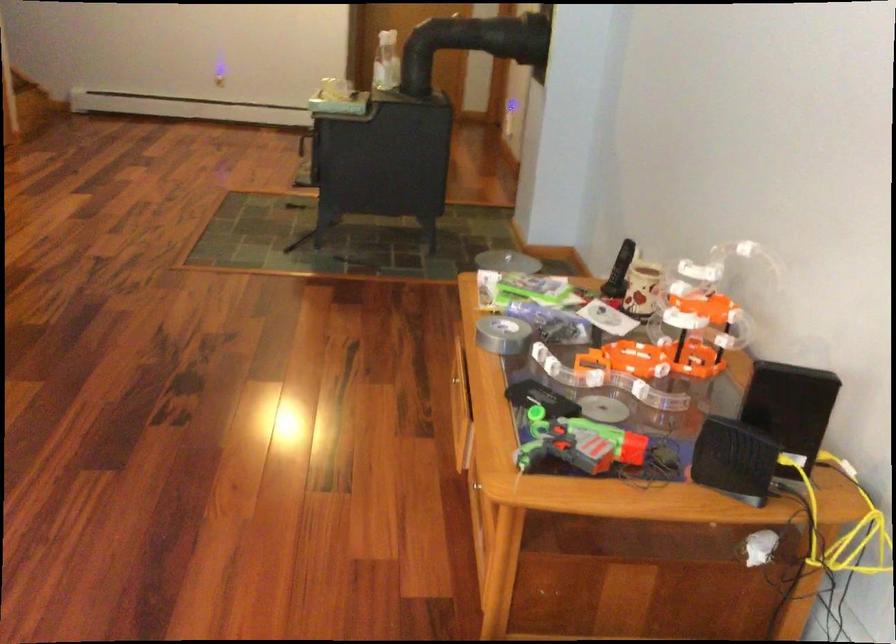
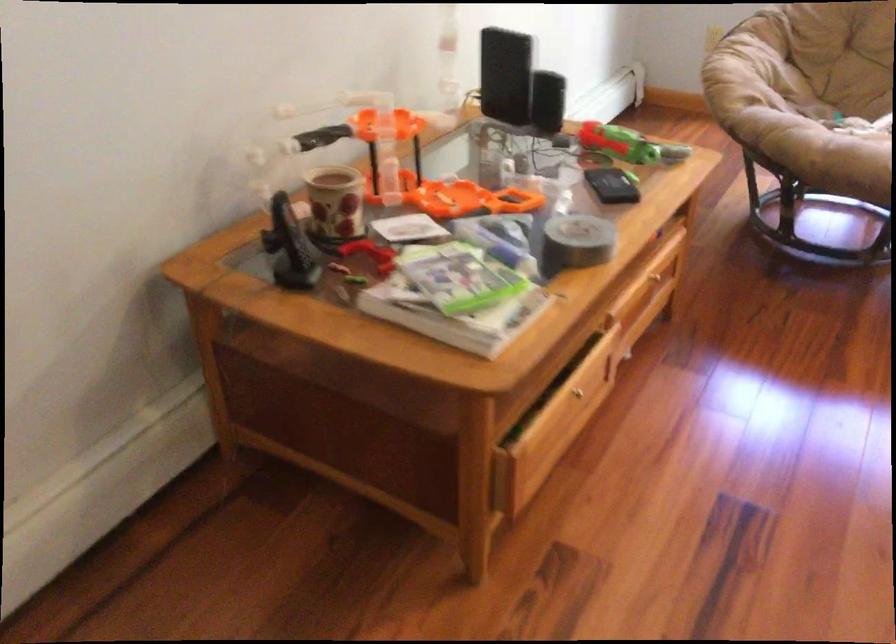
In the second image, find the point that corresponds to pixel 531 286 in the first image.

(459, 277)